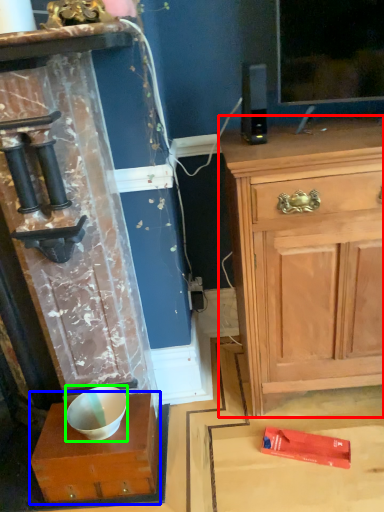
Question: Which is nearer to the chest of drawers (highlighted by a red box)? cabinetry (highlighted by a blue box) or bowl (highlighted by a green box).

Choices:
 (A) cabinetry
 (B) bowl

Answer: (A)